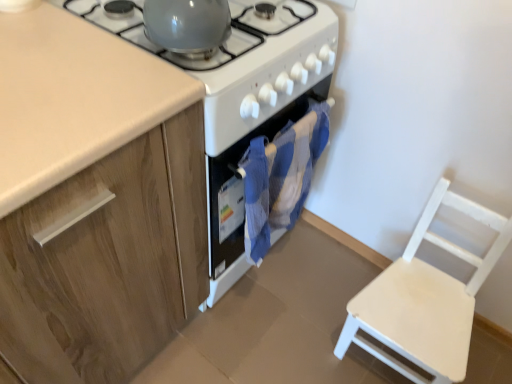
Question: From a real-world perspective, is wooden cabinet at left above or below white glossy stove at center?

Choices:
 (A) above
 (B) below

Answer: (A)

Question: Is wooden cabinet at left bigger or smaller than white glossy stove at center?

Choices:
 (A) small
 (B) big

Answer: (B)

Question: Which object is the farthest from the blue fabric oven at center?

Choices:
 (A) wooden cabinet at left
 (B) white glossy stove at center
 (C) glossy ceramic kettle at upper center, the 2th gas stove viewed from the left
 (D) white wooden chair at lower right
 (E) white glossy gas stove at center, the first gas stove positioned from the left

Answer: (D)

Question: Which is nearer to the glossy ceramic kettle at upper center, acting as the first gas stove starting from the right?

Choices:
 (A) white glossy gas stove at center, the first gas stove positioned from the left
 (B) white glossy stove at center
 (C) blue fabric oven at center
 (D) white wooden chair at lower right
 (E) wooden cabinet at left

Answer: (A)